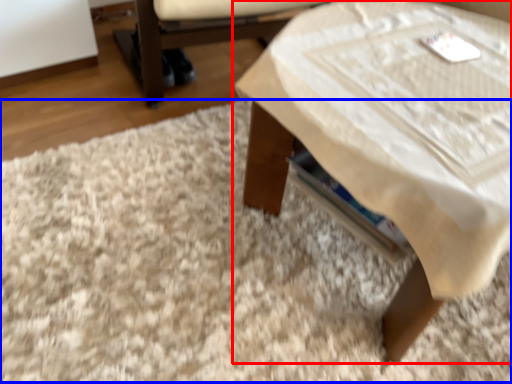
Question: Which object is closer to the camera taking this photo, table (highlighted by a red box) or mat (highlighted by a blue box)?

Choices:
 (A) table
 (B) mat

Answer: (A)